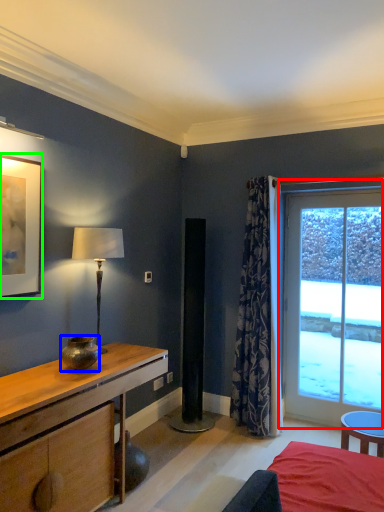
Question: Which object is positioned closest to window (highlighted by a red box)? Select from vase (highlighted by a blue box) and picture frame (highlighted by a green box).

Choices:
 (A) vase
 (B) picture frame

Answer: (A)